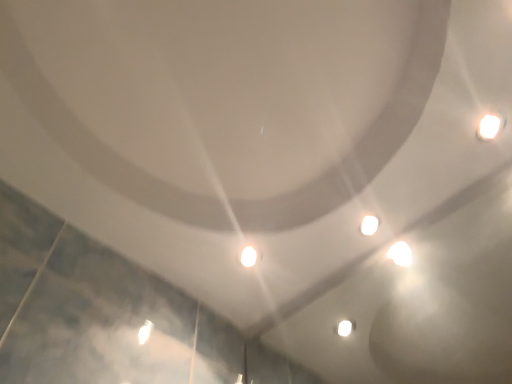
The image size is (512, 384). What do you see at coordinates (249, 255) in the screenshot?
I see `white glossy droplight at center` at bounding box center [249, 255].

What is the approximate height of white glossy droplight at center?

The height of white glossy droplight at center is 1.39 centimeters.

Identify the location of white glossy droplight at center. (249, 255).

In order to face white glossy droplight at center, should I rotate leftwards or rightwards?

You should look left and rotate roughly 1.488 degrees.

Where is `white glossy droplight at center`? This screenshot has width=512, height=384. white glossy droplight at center is located at coordinates (249, 255).